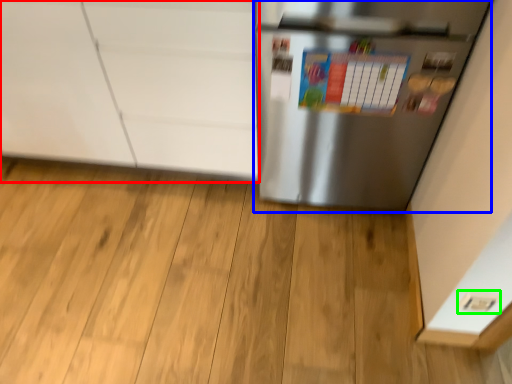
Question: Which is nearer to the cabinetry (highlighted by a red box)? refrigerator (highlighted by a blue box) or electric outlet (highlighted by a green box).

Choices:
 (A) refrigerator
 (B) electric outlet

Answer: (A)